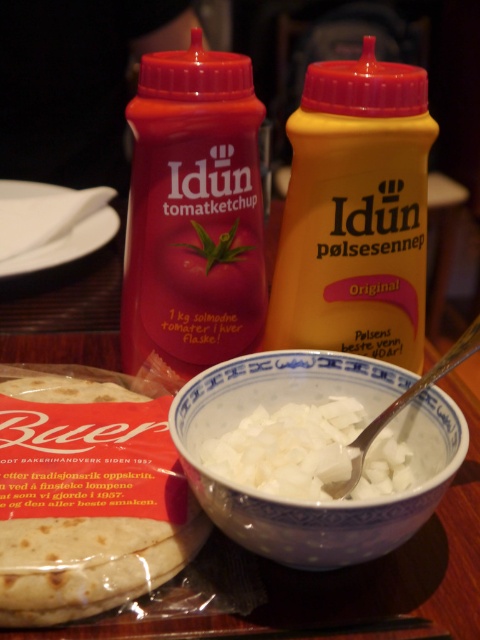
Question: Does matte plastic bottle at upper left appear on the right side of white porcelain bowl at center?

Choices:
 (A) yes
 (B) no

Answer: (B)

Question: Based on their relative distances, which object is farther from the matte plastic bottle at upper left?

Choices:
 (A) golden brown flatbread at lower left
 (B) white diced onion at center
 (C) white porcelain bowl at center

Answer: (B)

Question: Which object is closer to the camera taking this photo?

Choices:
 (A) matte plastic bottle at upper left
 (B) white porcelain bowl at center
 (C) white creamy bowl at center

Answer: (B)

Question: Which object is farther from the camera taking this photo?

Choices:
 (A) white creamy bowl at center
 (B) white diced onion at center
 (C) golden brown flatbread at lower left

Answer: (A)

Question: Is white creamy bowl at center to the right of white porcelain bowl at center from the viewer's perspective?

Choices:
 (A) no
 (B) yes

Answer: (B)

Question: Does matte plastic bottle at upper left appear on the left side of golden brown flatbread at lower left?

Choices:
 (A) no
 (B) yes

Answer: (A)